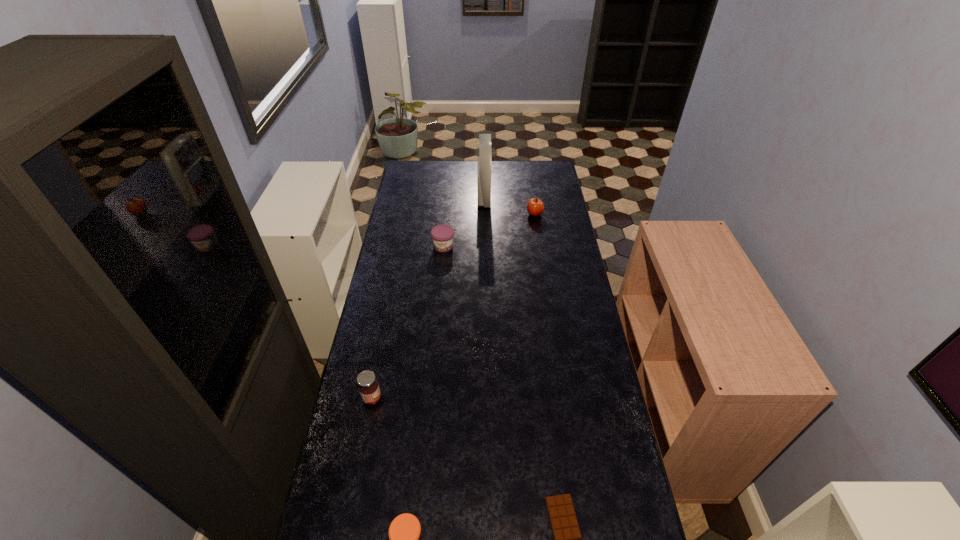
Where is `vacant region located 0.070m on the label side of the leftmost jam`? Image resolution: width=960 pixels, height=540 pixels. vacant region located 0.070m on the label side of the leftmost jam is located at coordinates (403, 398).

Find the location of `vacant space situated 0.370m on the front of the apple`. vacant space situated 0.370m on the front of the apple is located at coordinates (543, 272).

The height and width of the screenshot is (540, 960). What are the coordinates of `vacant point located 0.360m on the front label of the fourth tallest object` in the screenshot? It's located at (437, 315).

You are a GUI agent. You are given a task and a screenshot of the screen. Output one action in this format:
    pyautogui.click(x=<x>, y=<y>)
    Task: Click on the object located at the left edge
    The image size is (960, 540).
    Given the screenshot: What is the action you would take?
    click(368, 387)

Locate an element on the screen. This screenshot has height=540, width=960. object present at the right edge is located at coordinates (535, 206).

At what (x,y) coordinates should I click in order to perform the action: click on vacant region at the far edge of the desktop. Please return your answer as a coordinate pair (x, y). Image resolution: width=960 pixels, height=540 pixels. Looking at the image, I should click on 438,165.

At what (x,y) coordinates should I click in order to perform the action: click on vacant space at the left edge. Please return your answer as a coordinate pair (x, y). This screenshot has height=540, width=960. Looking at the image, I should click on (412, 188).

The image size is (960, 540). I want to click on vacant space at the right edge, so click(560, 205).

The height and width of the screenshot is (540, 960). Find the location of `vacant space at the far left corner of the desktop`. vacant space at the far left corner of the desktop is located at coordinates (426, 165).

In order to click on vacant area that lies between the apple and the farthest jam in this screenshot , I will do `click(490, 231)`.